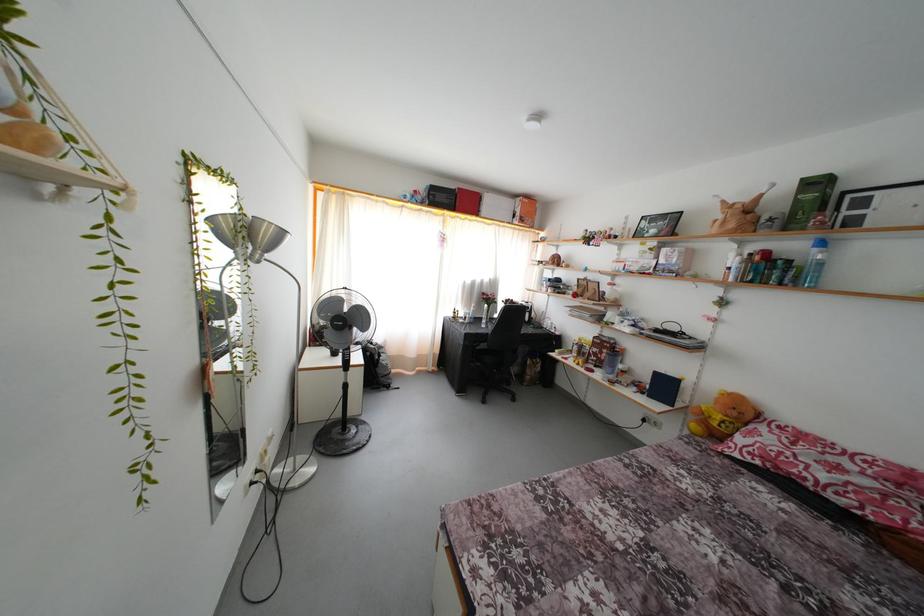
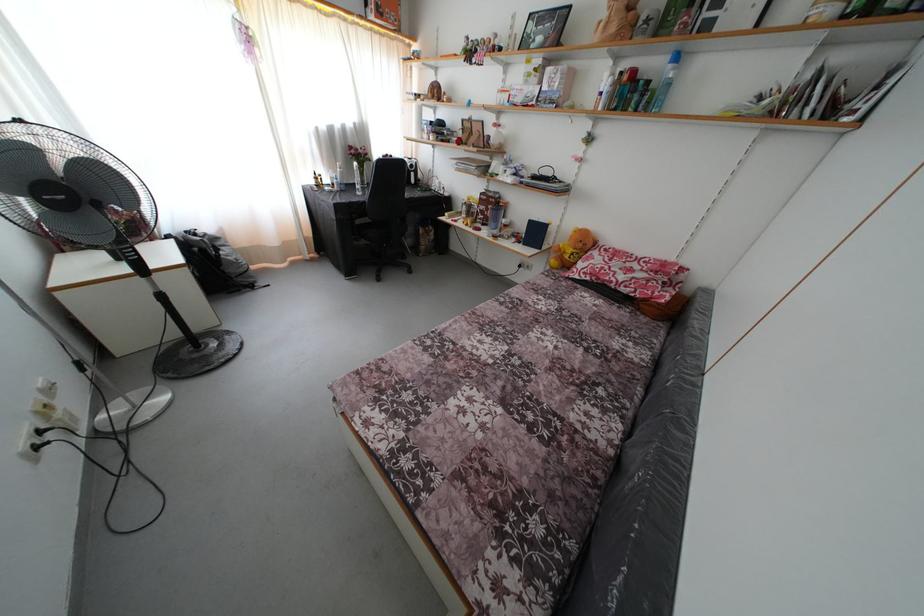
Where in the second image is the point corresponding to point (601, 371) from the first image?

(488, 230)